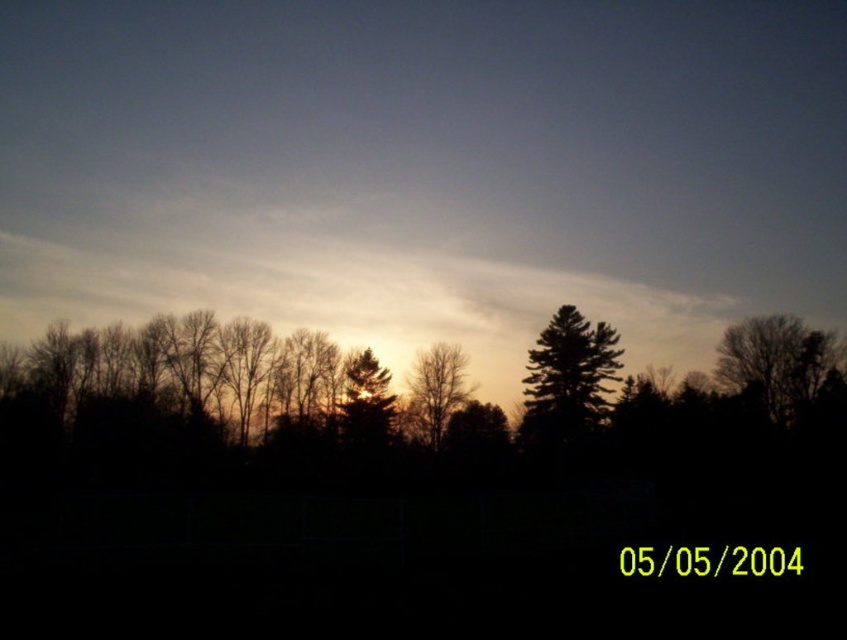
Question: Is bare branches at right to the left of silvery metallic tree at center from the viewer's perspective?

Choices:
 (A) yes
 (B) no

Answer: (B)

Question: Considering the real-world distances, which object is closest to the silvery metallic tree at center?

Choices:
 (A) dark green textured tree at center
 (B) brown matte tree at center

Answer: (B)

Question: Where is bare branches at right located in relation to silvery metallic tree at center in the image?

Choices:
 (A) above
 (B) below

Answer: (A)

Question: Is dark green textured tree at center closer to the viewer compared to silvery metallic tree at center?

Choices:
 (A) yes
 (B) no

Answer: (B)

Question: Among these points, which one is farthest from the camera?

Choices:
 (A) (416, 364)
 (B) (807, 364)
 (C) (545, 397)

Answer: (A)

Question: Based on their relative distances, which object is farther from the bare branches at right?

Choices:
 (A) silvery metallic tree at center
 (B) dark green textured tree at center

Answer: (A)